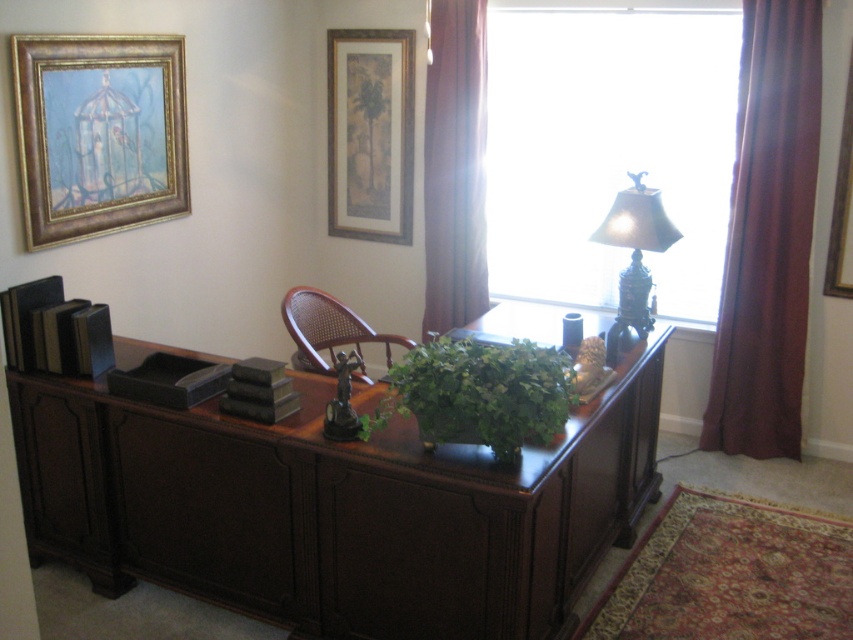
You are standing in front of the desk in the home office. You want to reach the matte gold picture frame at upper center without moving the desk. Can you do it?

The matte gold picture frame at upper center is 4.50 meters away from camera, so you can reach it without moving the desk as it is within a reasonable distance.

You are standing in front of the home office scene. You want to place a 2.5 meter long banner horizontally on the floor between yourself and the dark wood desk at center. Will the banner be long enough to reach from your position to the desk?

The distance between you and the dark wood desk at center is 2.27 meters. The banner is 2.5 meters long, which is longer than the distance. Therefore, the banner will be long enough to reach from your position to the desk.

You are a delivery person who needs to place a package between the matte gold picture frame at upper center and the brown cane chair at center. The package requires 1 meter of space. Is there enough space?

The distance between the matte gold picture frame at upper center and the brown cane chair at center is 1.22 meters, which is more than the required 1 meter. Therefore, there is enough space to place the package between them.